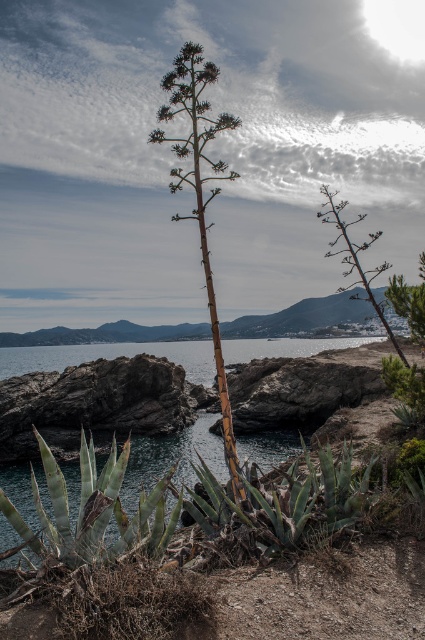
Can you confirm if brown woody stem at center is wider than green spiky plant at center?

No.

Is brown woody stem at center to the right of green spiky plant at center from the viewer's perspective?

Incorrect, brown woody stem at center is not on the right side of green spiky plant at center.

Find the location of a particular element. brown woody stem at center is located at coordinates (201, 196).

Who is positioned more to the left, dark gray rock at center or brown woody stem at center?

From the viewer's perspective, dark gray rock at center appears more on the left side.

Who is positioned more to the right, dark gray rock at center or brown woody stem at center?

Positioned to the right is brown woody stem at center.

This screenshot has width=425, height=640. Describe the element at coordinates (93, 404) in the screenshot. I see `dark gray rock at center` at that location.

Find the location of `dark gray rock at center`. dark gray rock at center is located at coordinates (93, 404).

Between dark gray rock at center and green spiky plant at center, which one has less height?

dark gray rock at center

Who is positioned more to the left, dark gray rock at center or green spiky plant at center?

From the viewer's perspective, dark gray rock at center appears more on the left side.

This screenshot has height=640, width=425. Describe the element at coordinates (93, 404) in the screenshot. I see `dark gray rock at center` at that location.

Identify the location of dark gray rock at center. The width and height of the screenshot is (425, 640). [93, 404].